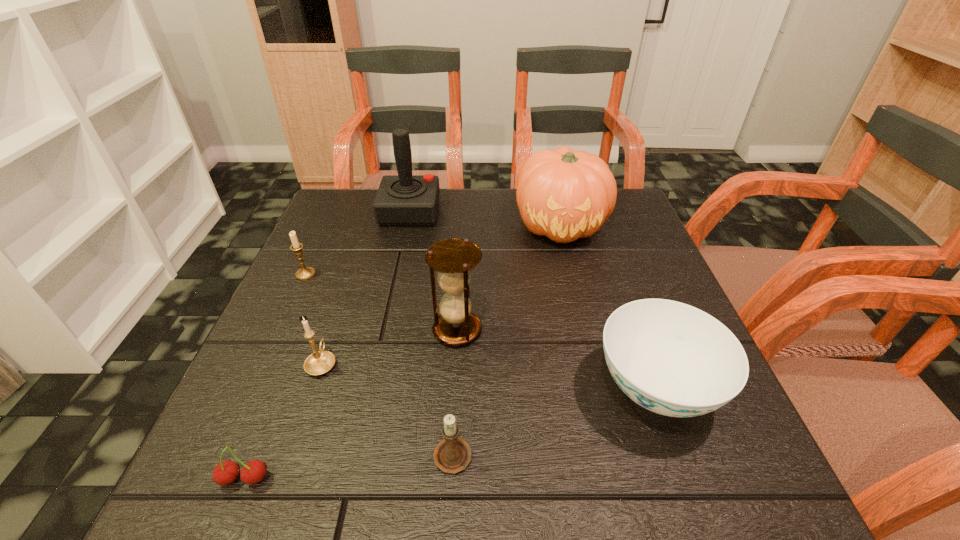
Identify the location of vacant space positioned on the carved face of the pumpkin. (578, 295).

You are a GUI agent. You are given a task and a screenshot of the screen. Output one action in this format:
    pyautogui.click(x=<x>, y=<y>)
    Task: Click on the blank area located on the back of the hourglass
    The image size is (960, 540).
    Given the screenshot: What is the action you would take?
    click(463, 231)

Where is `vacant point located on the handle side of the second candle holder from left to right`? vacant point located on the handle side of the second candle holder from left to right is located at coordinates (359, 253).

Image resolution: width=960 pixels, height=540 pixels. What are the coordinates of `free region located on the handle side of the second candle holder from left to right` in the screenshot? It's located at (353, 269).

This screenshot has width=960, height=540. Identify the location of free space located on the handle side of the second candle holder from left to right. (347, 289).

This screenshot has width=960, height=540. What are the coordinates of `free space located on the right of the leftmost candle holder` in the screenshot? It's located at (466, 274).

Where is `vacant region located 0.220m on the left of the chinaware`? Image resolution: width=960 pixels, height=540 pixels. vacant region located 0.220m on the left of the chinaware is located at coordinates (470, 388).

Where is `vacant space situated 0.090m on the side of the nearest candle holder with the handle`? The width and height of the screenshot is (960, 540). vacant space situated 0.090m on the side of the nearest candle holder with the handle is located at coordinates (456, 384).

This screenshot has height=540, width=960. What are the coordinates of `free space located on the side of the nearest candle holder with the handle` in the screenshot? It's located at (461, 287).

You are a GUI agent. You are given a task and a screenshot of the screen. Output one action in this format:
    pyautogui.click(x=<x>, y=<y>)
    Task: Click on the blank area located 0.120m on the side of the nearest candle holder with the handle
    This screenshot has height=540, width=960.
    Given the screenshot: What is the action you would take?
    pyautogui.click(x=457, y=371)